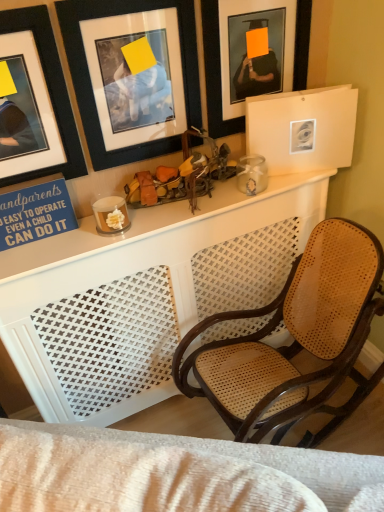
Question: From their relative heights in the image, would you say matte black picture frame at upper center, the first picture frame in the right-to-left sequence, is taller or shorter than black matte picture frame at upper left, the 3th picture frame in the right-to-left sequence?

Choices:
 (A) short
 (B) tall

Answer: (A)

Question: Looking at their shapes, would you say matte black picture frame at upper center, the first picture frame in the right-to-left sequence, is wider or thinner than black matte picture frame at upper left, acting as the 1th picture frame starting from the left?

Choices:
 (A) thin
 (B) wide

Answer: (A)

Question: Based on their relative distances, which object is farther from the black matte picture frame at upper left, which is the 2th picture frame in right-to-left order?

Choices:
 (A) matte black picture frame at upper center, the first picture frame in the right-to-left sequence
 (B) black matte picture frame at upper left, acting as the 1th picture frame starting from the left

Answer: (A)

Question: Estimate the real-world distances between objects in this image. Which object is farther from the black matte picture frame at upper left, the 3th picture frame in the right-to-left sequence?

Choices:
 (A) matte black picture frame at upper center, which appears as the third picture frame when viewed from the left
 (B) black matte picture frame at upper left, which appears as the second picture frame when viewed from the left

Answer: (A)